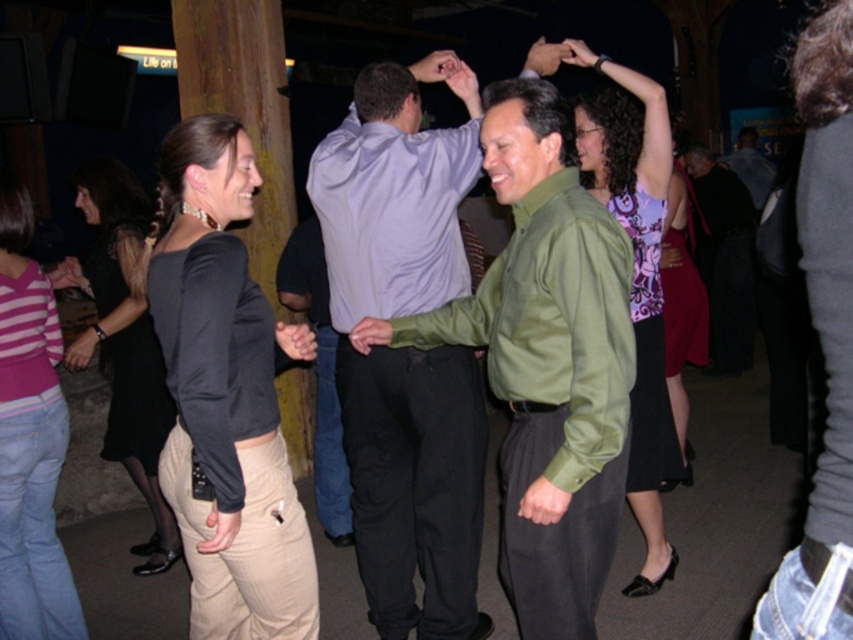
Consider the image. You are standing at the center of the room and want to move towards the khaki pants at lower left. Which direction should you move in to reach them?

Since the khaki pants at lower left are located at point 0.620 on the x and 0.265 on the y, you should move to the lower left direction to reach them.

You are standing at the entrance of the venue and want to take a photo that includes both the point at coordinates point (184, 358) and the point at coordinates point (746, 195). Based on their positions, which point should you focus on first to ensure both are in frame?

You should focus on point (184, 358) first because it is closer to you than point (746, 195), ensuring both points remain within the frame.

You are standing at the center of the room. There is a point marked at coordinates (225, 396). What object is located at this point?

The point at coordinates (225, 396) corresponds to the khaki pants at lower left.